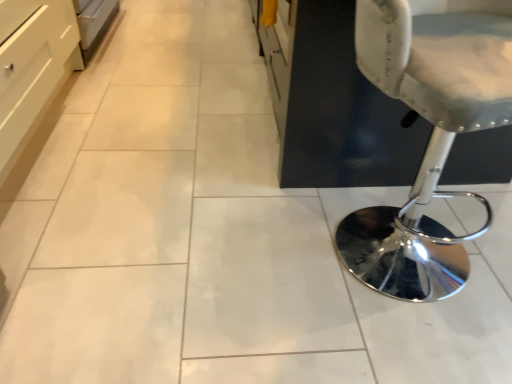
Question: Is white leather stool at right oriented towards white glossy drawer at left?

Choices:
 (A) yes
 (B) no

Answer: (B)

Question: Is white glossy drawer at left at the back of white leather stool at right?

Choices:
 (A) yes
 (B) no

Answer: (B)

Question: Is white leather stool at right not close to white glossy drawer at left?

Choices:
 (A) no
 (B) yes

Answer: (B)

Question: Would you say white leather stool at right contains white glossy drawer at left?

Choices:
 (A) no
 (B) yes

Answer: (A)

Question: From a real-world perspective, is white leather stool at right physically above white glossy drawer at left?

Choices:
 (A) no
 (B) yes

Answer: (B)

Question: Can you confirm if white leather stool at right is wider than white glossy drawer at left?

Choices:
 (A) no
 (B) yes

Answer: (B)

Question: From the image's perspective, is white glossy drawer at left above white leather stool at right?

Choices:
 (A) no
 (B) yes

Answer: (B)

Question: Is white glossy drawer at left completely or partially outside of white leather stool at right?

Choices:
 (A) yes
 (B) no

Answer: (A)

Question: From a real-world perspective, is white glossy drawer at left located beneath white leather stool at right?

Choices:
 (A) yes
 (B) no

Answer: (A)

Question: Is white glossy drawer at left thinner than white leather stool at right?

Choices:
 (A) yes
 (B) no

Answer: (A)

Question: From the image's perspective, does white glossy drawer at left appear lower than white leather stool at right?

Choices:
 (A) no
 (B) yes

Answer: (A)

Question: Does white glossy drawer at left turn towards white leather stool at right?

Choices:
 (A) no
 (B) yes

Answer: (B)

Question: Considering the positions of white leather stool at right and white glossy drawer at left in the image, is white leather stool at right wider or thinner than white glossy drawer at left?

Choices:
 (A) thin
 (B) wide

Answer: (B)